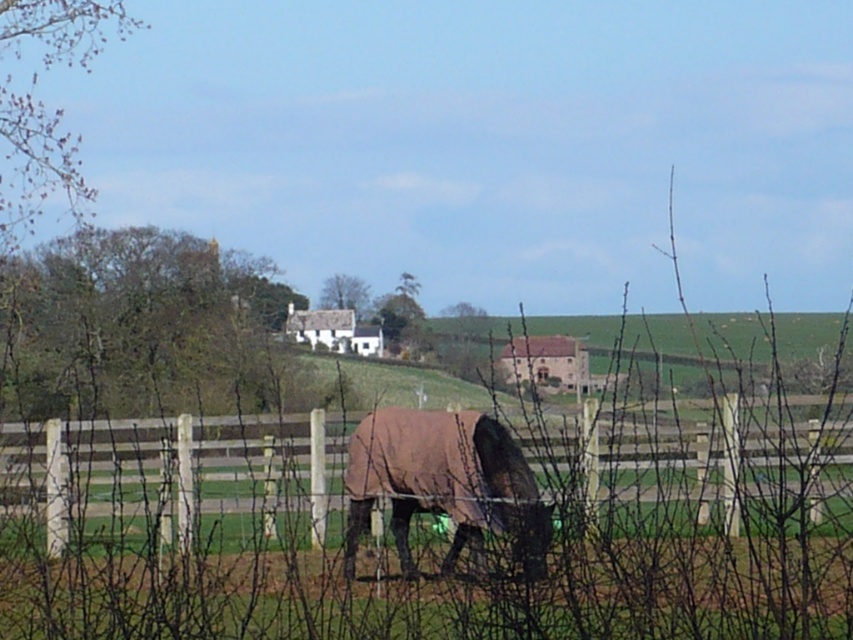
This screenshot has width=853, height=640. What do you see at coordinates (413, 467) in the screenshot? I see `brown wooden fence at lower center` at bounding box center [413, 467].

Does point (289, 456) come behind point (393, 508)?

No, (289, 456) is in front of (393, 508).

Identify the location of brown wooden fence at lower center. The width and height of the screenshot is (853, 640). (413, 467).

Locate an element on the screen. The width and height of the screenshot is (853, 640). brown wooden fence at lower center is located at coordinates (413, 467).